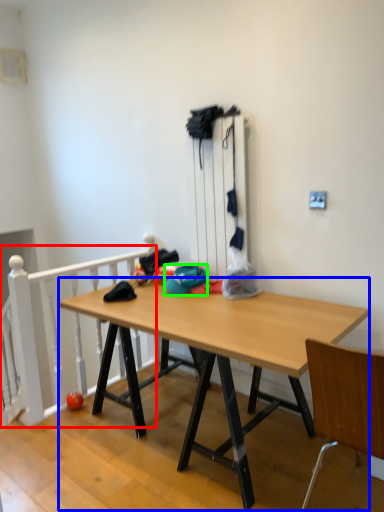
Question: Which object is positioned farthest from rail (highlighted by a red box)? Select from desk (highlighted by a blue box) and hat (highlighted by a green box).

Choices:
 (A) desk
 (B) hat

Answer: (B)